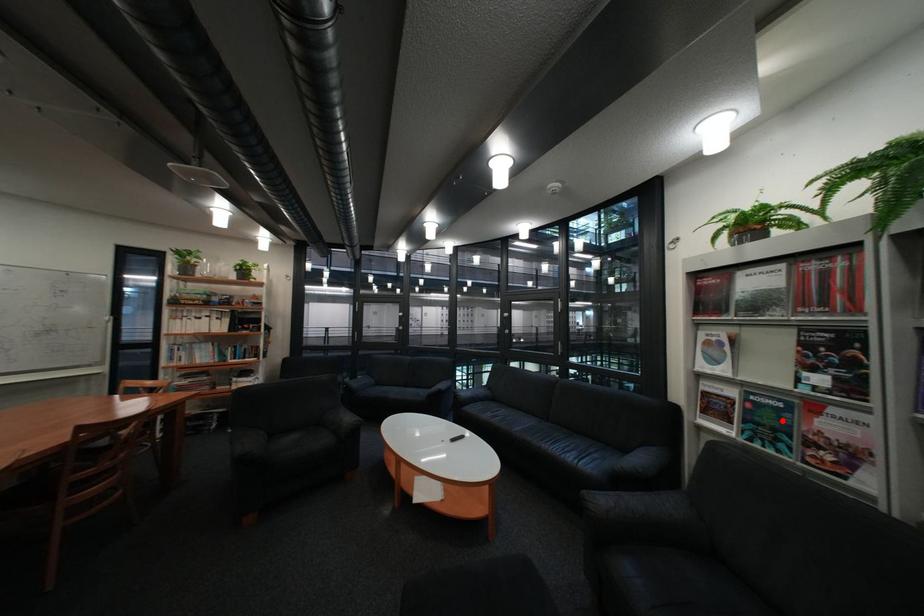
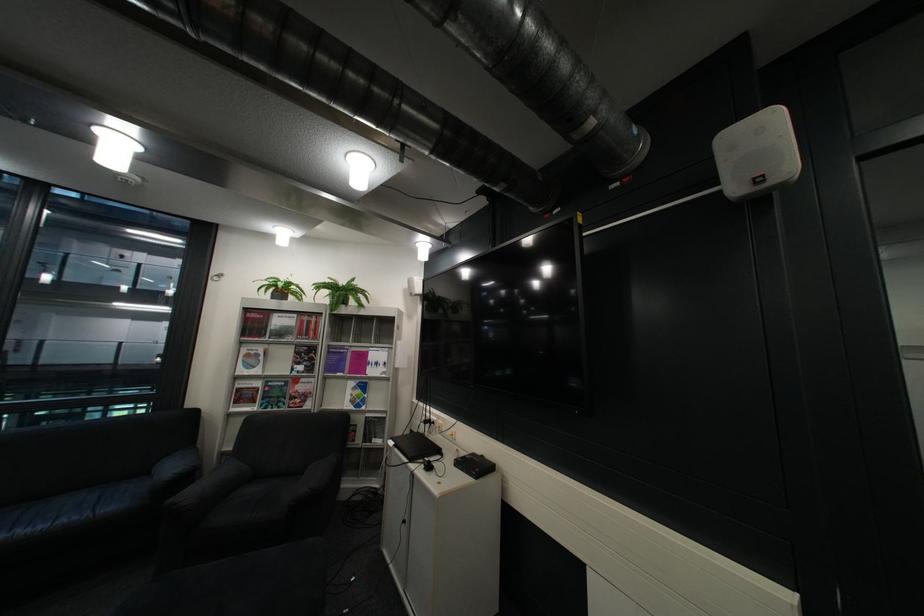
Question: A red point is marked in image1. In image2, is the corresponding 3D point closer to the camera or farther? Reply with the corresponding letter.

Choices:
 (A) The corresponding 3D point is closer.
 (B) The corresponding 3D point is farther.

Answer: (B)